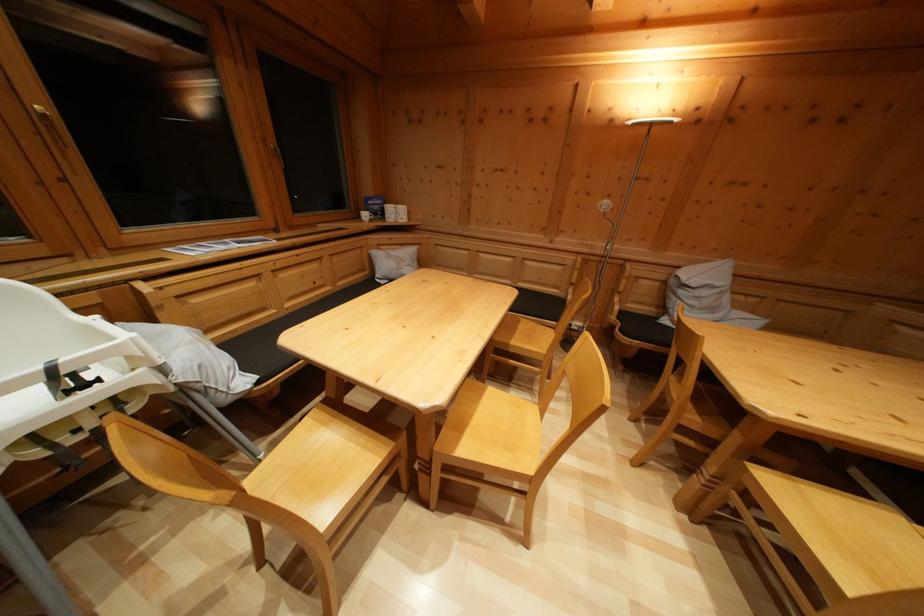
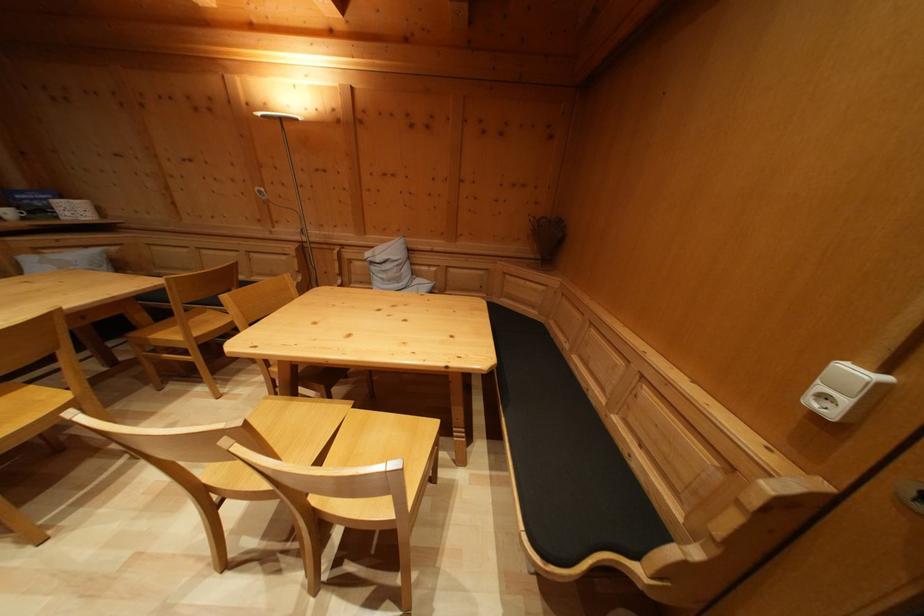
Question: In a continuous first-person perspective shot, in which direction is the camera moving?

Choices:
 (A) Left
 (B) Right
 (C) Forward
 (D) Backward

Answer: (B)